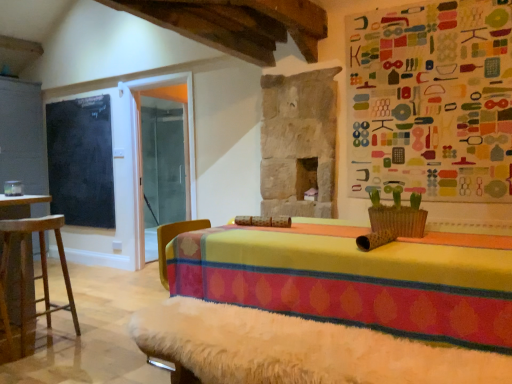
Question: Does white fur-covered bench at lower center have a lesser width compared to black chalkboard at left?

Choices:
 (A) no
 (B) yes

Answer: (A)

Question: Considering the relative positions of white fur-covered bench at lower center and black chalkboard at left in the image provided, is white fur-covered bench at lower center to the right of black chalkboard at left from the viewer's perspective?

Choices:
 (A) yes
 (B) no

Answer: (A)

Question: Is white fur-covered bench at lower center beside black chalkboard at left?

Choices:
 (A) no
 (B) yes

Answer: (A)

Question: Does white fur-covered bench at lower center have a lesser height compared to black chalkboard at left?

Choices:
 (A) no
 (B) yes

Answer: (B)

Question: Considering the relative sizes of white fur-covered bench at lower center and black chalkboard at left in the image provided, is white fur-covered bench at lower center smaller than black chalkboard at left?

Choices:
 (A) yes
 (B) no

Answer: (B)

Question: Can black chalkboard at left be found inside white fur-covered bench at lower center?

Choices:
 (A) no
 (B) yes

Answer: (A)

Question: Is white fur-covered bench at lower center bigger than wooden stool at left?

Choices:
 (A) yes
 (B) no

Answer: (A)

Question: Is white fur-covered bench at lower center taller than wooden stool at left?

Choices:
 (A) no
 (B) yes

Answer: (A)

Question: From a real-world perspective, does white fur-covered bench at lower center sit lower than wooden stool at left?

Choices:
 (A) yes
 (B) no

Answer: (A)

Question: Does white fur-covered bench at lower center have a smaller size compared to wooden stool at left?

Choices:
 (A) yes
 (B) no

Answer: (B)

Question: Is white fur-covered bench at lower center positioned beyond the bounds of wooden stool at left?

Choices:
 (A) yes
 (B) no

Answer: (A)

Question: Would you consider white fur-covered bench at lower center to be distant from wooden stool at left?

Choices:
 (A) no
 (B) yes

Answer: (B)

Question: Can you confirm if black chalkboard at left is shorter than wooden stool at left?

Choices:
 (A) no
 (B) yes

Answer: (A)